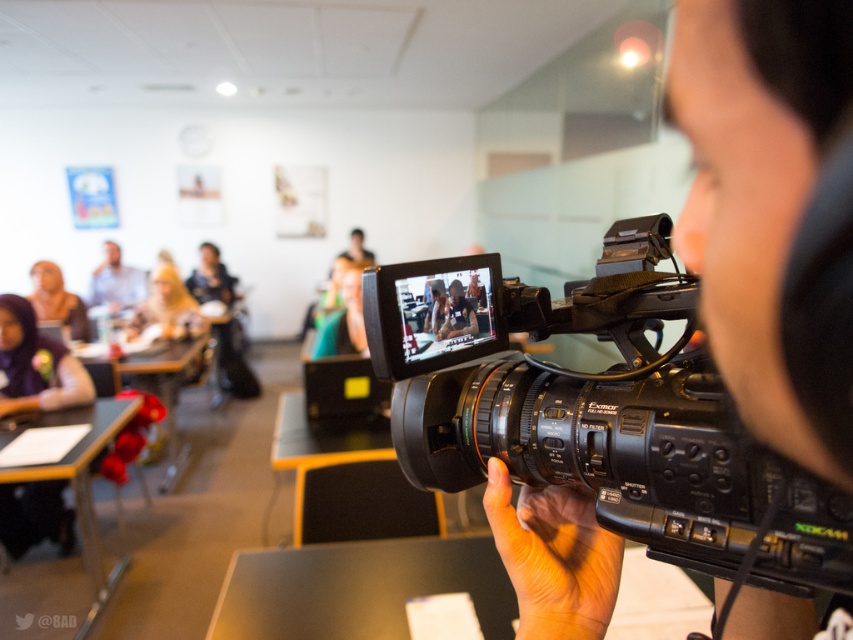
Does point (74, 451) come closer to viewer compared to point (149, 381)?

Yes, point (74, 451) is closer to viewer.

Image resolution: width=853 pixels, height=640 pixels. Describe the element at coordinates (84, 486) in the screenshot. I see `wooden table at lower left` at that location.

Does point (125, 564) lie in front of point (141, 376)?

Yes, point (125, 564) is in front of point (141, 376).

Identify the location of wooden table at lower left. The height and width of the screenshot is (640, 853). (84, 486).

Does purple hair at upper left appear on the left side of matte white shirt at upper left?

Result: Incorrect, purple hair at upper left is not on the left side of matte white shirt at upper left.

Can you confirm if purple hair at upper left is thinner than matte white shirt at upper left?

Correct, purple hair at upper left's width is less than matte white shirt at upper left's.

Is point (45, 508) positioned after point (105, 243)?

No.

Where is `purple hair at upper left`? purple hair at upper left is located at coordinates (35, 364).

Between purple hair at upper left and matte black hijab at upper center, which one appears on the right side from the viewer's perspective?

Positioned to the right is purple hair at upper left.

Where is `purple hair at upper left`? This screenshot has width=853, height=640. purple hair at upper left is located at coordinates (35, 364).